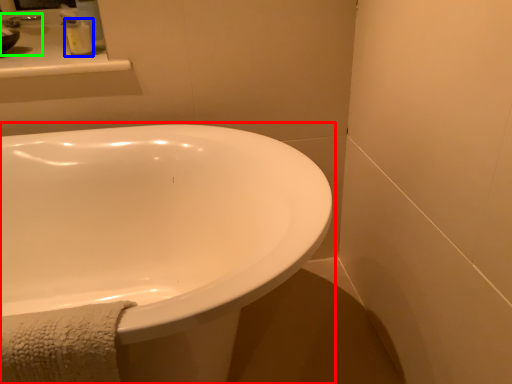
Question: Estimate the real-world distances between objects in this image. Which object is closer to bathtub (highlighted by a red box), soap dispenser (highlighted by a blue box) or sink (highlighted by a green box)?

Choices:
 (A) soap dispenser
 (B) sink

Answer: (A)